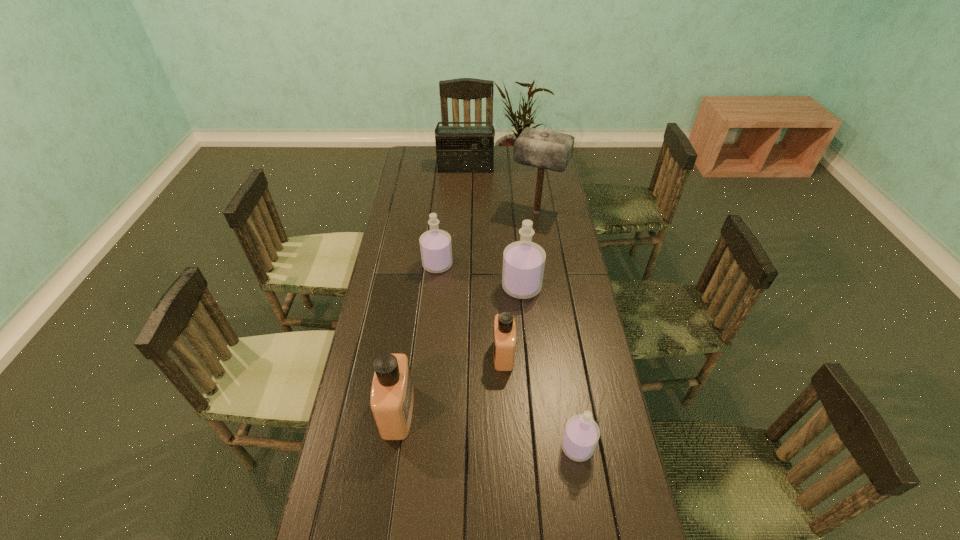
The image size is (960, 540). Identify the location of object located in the far edge section of the desktop. (459, 149).

Image resolution: width=960 pixels, height=540 pixels. I want to click on mallet situated at the right edge, so click(543, 149).

In the image, there is a desktop. Where is `free space at the left edge`? The image size is (960, 540). free space at the left edge is located at coordinates (406, 218).

This screenshot has height=540, width=960. What are the coordinates of `vacant position at the right edge of the desktop` in the screenshot? It's located at (562, 334).

The width and height of the screenshot is (960, 540). I want to click on vacant space at the far left corner, so click(x=418, y=147).

You are a GUI agent. You are given a task and a screenshot of the screen. Output one action in this format:
    pyautogui.click(x=<x>, y=<y>)
    Task: Click on the vacant region between the nearest purple perfume and the third nearest perfume
    The height and width of the screenshot is (540, 960).
    Given the screenshot: What is the action you would take?
    pyautogui.click(x=540, y=400)

Identify the location of unoccupied area between the smallest purple perfume and the sixth nearest object. (557, 329).

I want to click on free space between the third tallest object and the bigger beige perfume, so click(460, 349).

Identify the location of empty space that is in between the smallest purple perfume and the mallet. The height and width of the screenshot is (540, 960). (557, 329).

The width and height of the screenshot is (960, 540). I want to click on free spot between the smaller beige perfume and the nearer beige perfume, so click(x=450, y=383).